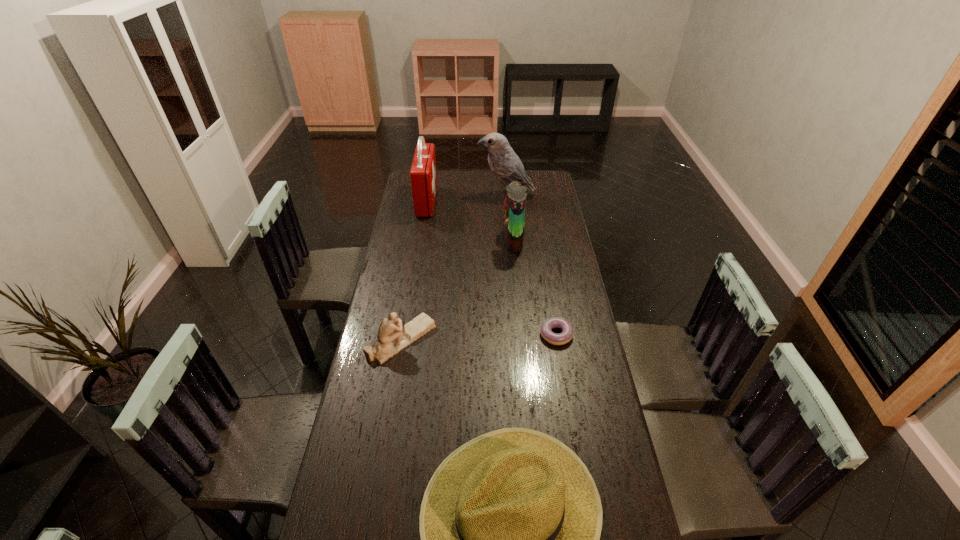
Where is `free spot located 0.120m at the face of the nearer parrot`? Image resolution: width=960 pixels, height=540 pixels. free spot located 0.120m at the face of the nearer parrot is located at coordinates (476, 240).

Locate an element on the screen. Image resolution: width=960 pixels, height=540 pixels. vacant area located 0.310m at the face of the nearer parrot is located at coordinates (434, 240).

Locate an element on the screen. Image resolution: width=960 pixels, height=540 pixels. vacant region located at the face of the nearer parrot is located at coordinates (443, 240).

In order to click on vacant space situated 0.260m on the front-facing side of the figurine in this screenshot , I will do `click(508, 340)`.

Locate an element on the screen. vacant region located on the left of the shortest object is located at coordinates (434, 334).

Find the location of `parrot that is positioned at the far edge`. parrot that is positioned at the far edge is located at coordinates (505, 164).

Where is `the first-aid kit that is at the far edge`? the first-aid kit that is at the far edge is located at coordinates (423, 176).

At what (x,y) coordinates should I click in order to perform the action: click on the first-aid kit located at the left edge. Please return your answer as a coordinate pair (x, y). This screenshot has height=540, width=960. Looking at the image, I should click on (423, 176).

You are a GUI agent. You are given a task and a screenshot of the screen. Output one action in this format:
    pyautogui.click(x=<x>, y=<y>)
    Task: Click on the figurine that is at the left edge
    This screenshot has height=540, width=960.
    Given the screenshot: What is the action you would take?
    pyautogui.click(x=392, y=338)

I want to click on parrot that is at the right edge, so click(505, 164).